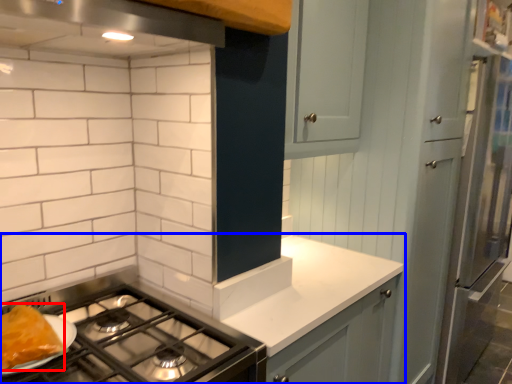
Question: Which object appears farthest to the camera in this image, food (highlighted by a red box) or countertop (highlighted by a blue box)?

Choices:
 (A) food
 (B) countertop

Answer: (B)